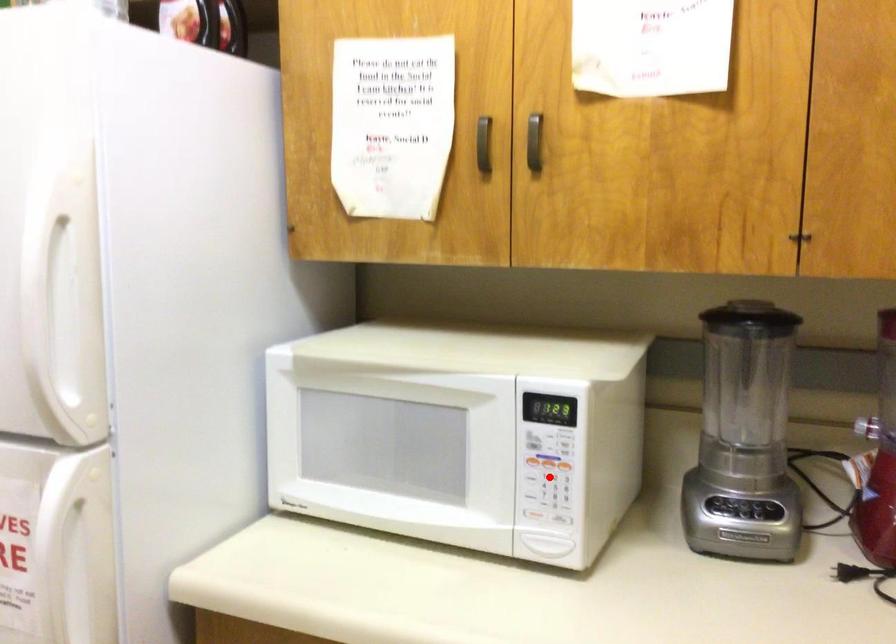
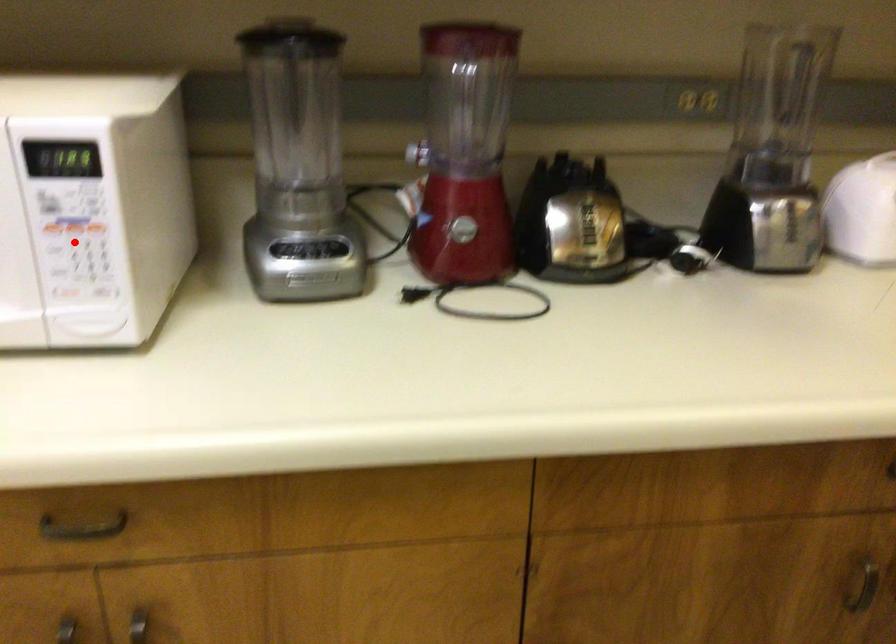
I am providing you with two images of the same scene from different viewpoints. A red point is marked on the first image and another point is marked on the second image. Is the red point in image1 aligned with the point shown in image2?

Yes